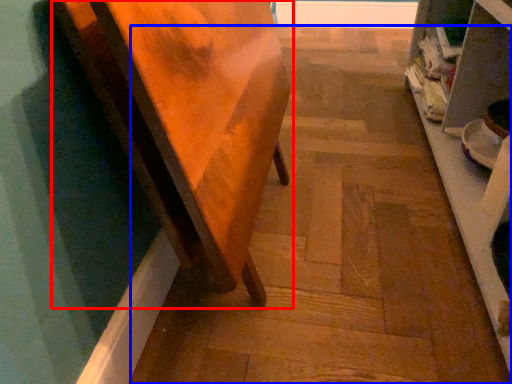
Question: Which object appears farthest to the camera in this image, furniture (highlighted by a red box) or stair (highlighted by a blue box)?

Choices:
 (A) furniture
 (B) stair

Answer: (B)